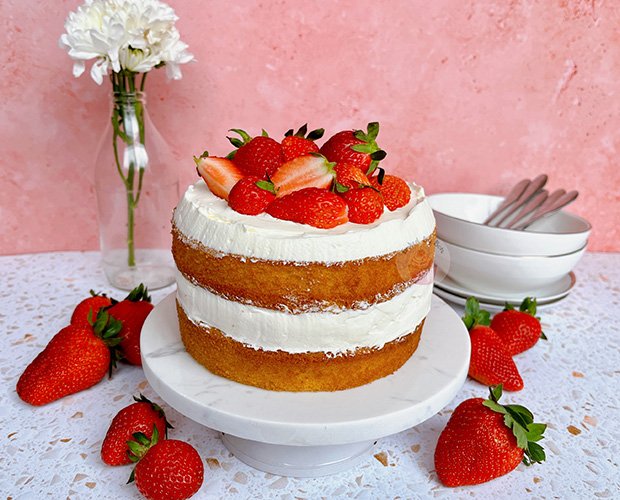
Locate an element on the screen. The height and width of the screenshot is (500, 620). wall is located at coordinates (418, 53).